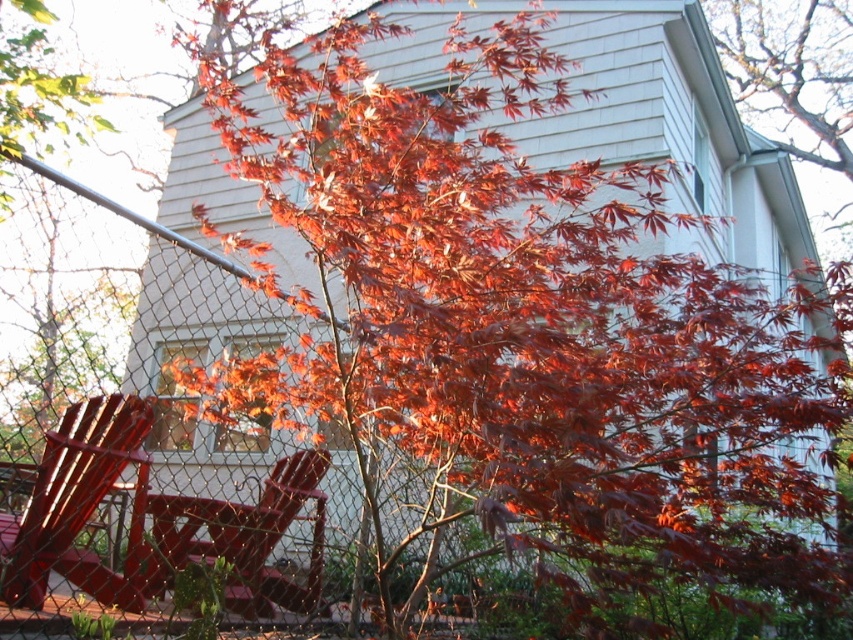
You are standing at the center of the image and want to move towards the metallic red chair at lower left. Which direction should you move relative to the current position?

You should move towards the lower left direction to reach the metallic red chair at lower left since its 2D location is at point [79,506].

You are standing in the garden and see both the metallic red chair at lower left and the matte red chair at lower left. Which chair is closer to you?

The metallic red chair at lower left is closer to you because it is further to the viewer than the matte red chair at lower left.

You are planning to place a new potted plant between the metallic red chair at lower left and the matte red chair at lower left. The plant pot has a diameter of 18 inches. Will there be enough space between the two chairs to fit the plant?

The metallic red chair at lower left and the matte red chair at lower left are 19.50 inches apart. Since the plant pot has a diameter of 18 inches, there is enough space between the two chairs to fit the plant.